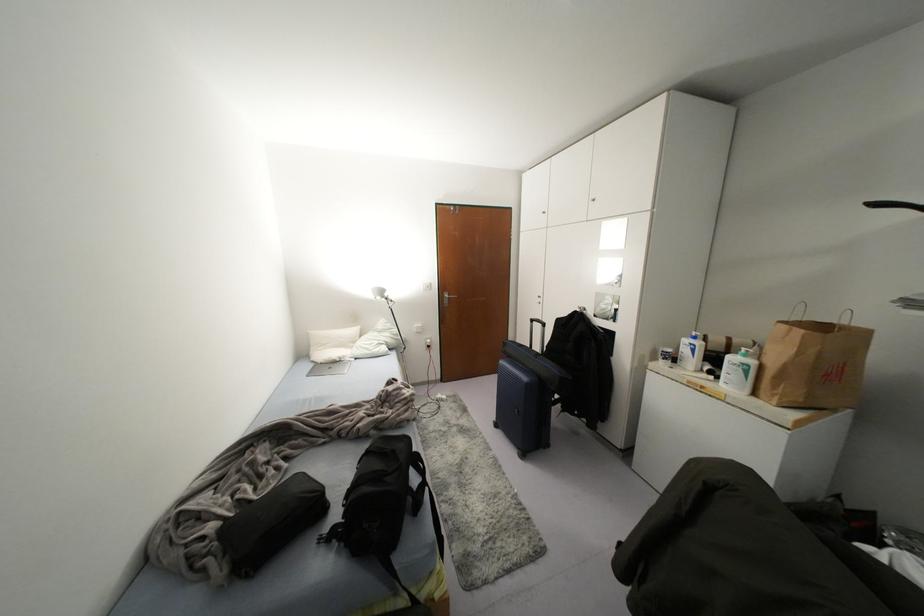
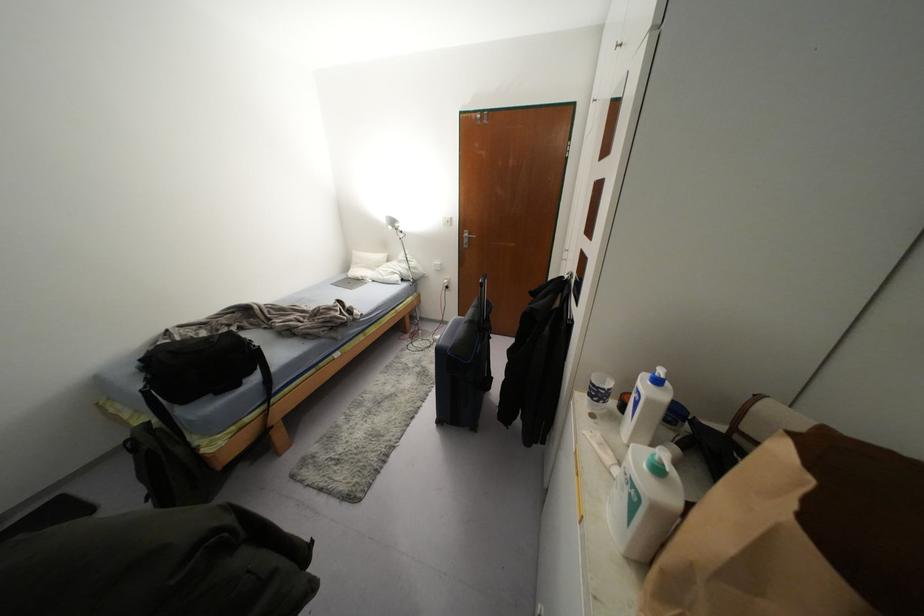
In the second image, find the point that corresponds to the point at 694,338 in the first image.

(658, 381)